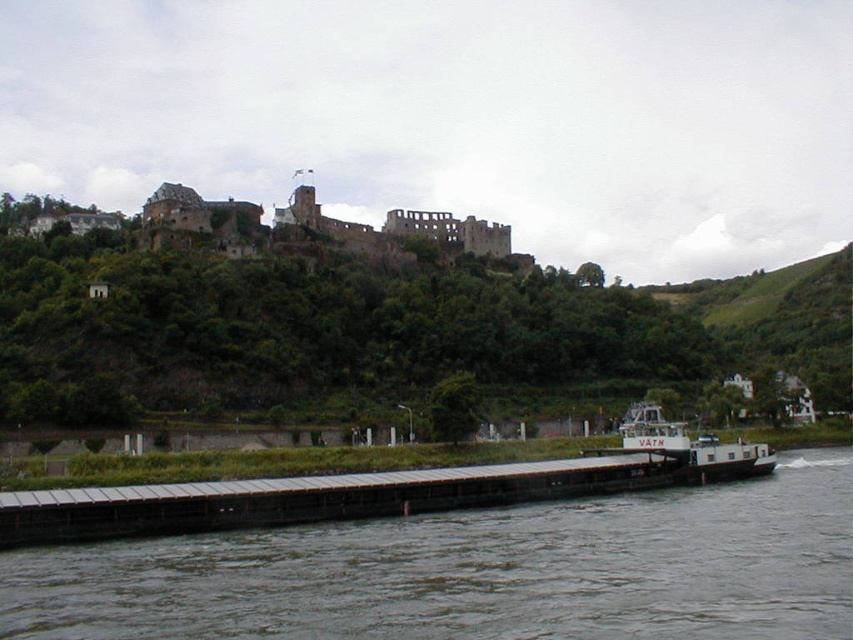
The image size is (853, 640). Describe the element at coordinates (477, 572) in the screenshot. I see `brown wooden dock at lower center` at that location.

Image resolution: width=853 pixels, height=640 pixels. Identify the location of brown wooden dock at lower center. (477, 572).

Between point (450, 614) and point (190, 499), which one is positioned in front?

Positioned in front is point (450, 614).

I want to click on brown wooden dock at lower center, so [477, 572].